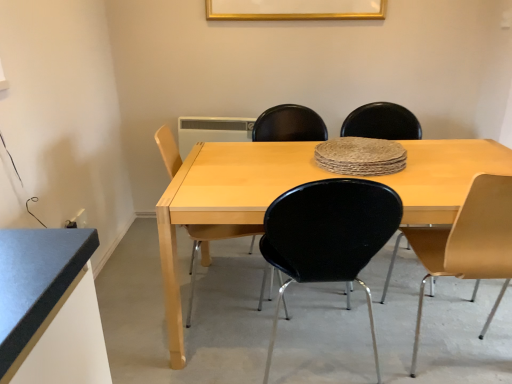
Find the location of `free space between matte yellow chair at right, which appears as the 4th chair when viewed from the left, and glossy black chair at center, which is the 2th chair from left to right`. free space between matte yellow chair at right, which appears as the 4th chair when viewed from the left, and glossy black chair at center, which is the 2th chair from left to right is located at coordinates (371, 336).